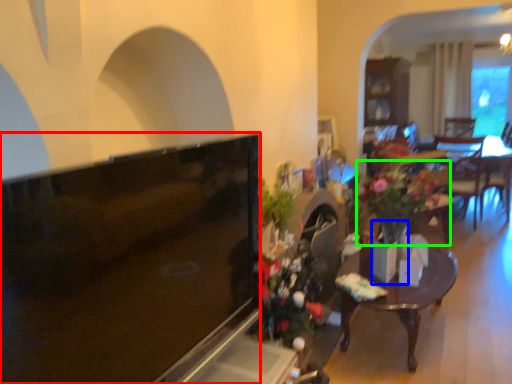
Question: Estimate the real-world distances between objects in this image. Which object is farther from television (highlighted by a red box), vase (highlighted by a blue box) or houseplant (highlighted by a green box)?

Choices:
 (A) vase
 (B) houseplant

Answer: (B)